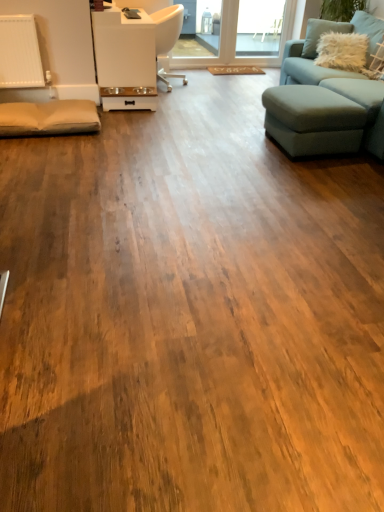
Image resolution: width=384 pixels, height=512 pixels. I want to click on vacant space in front of light blue fabric footrest at right, so click(x=299, y=169).